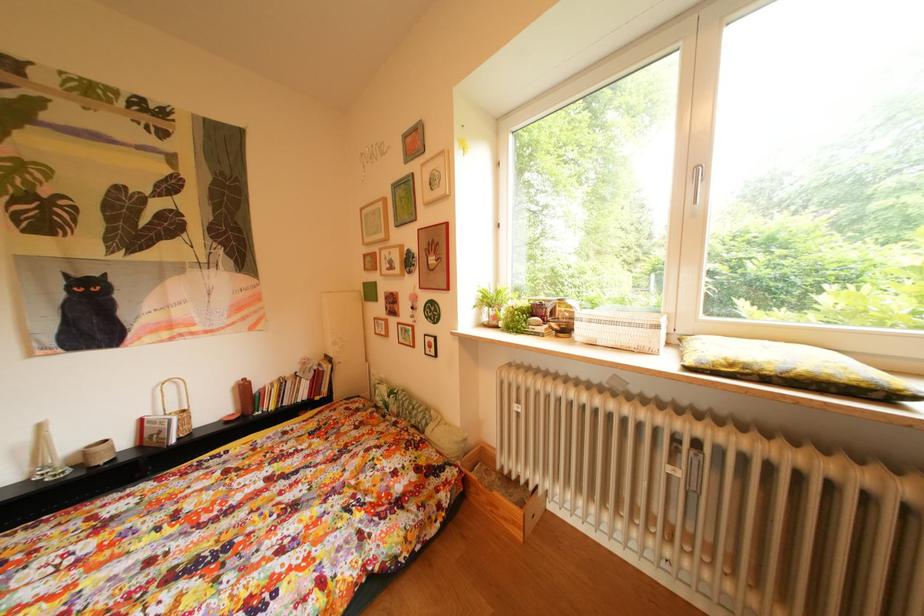
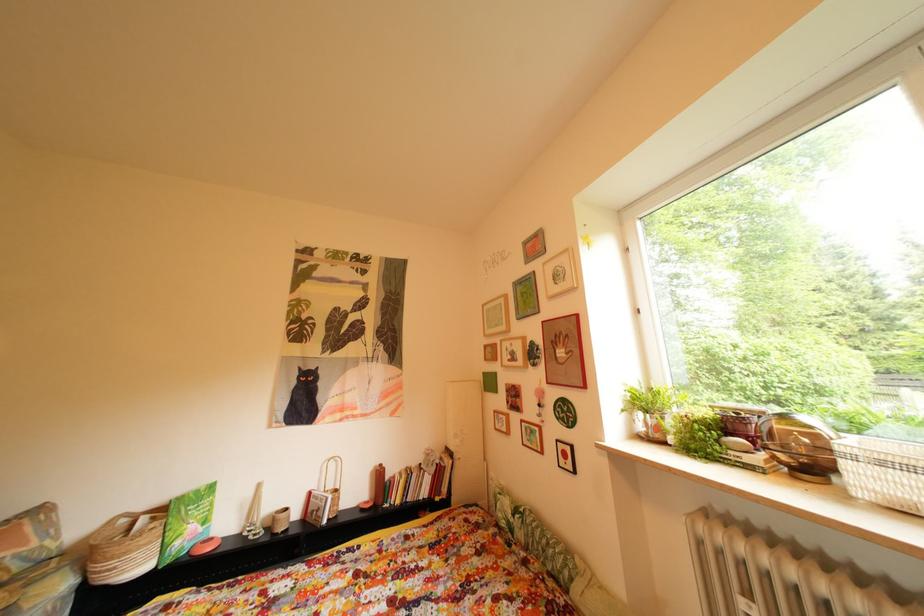
How did the camera likely rotate?

The rotation direction of the camera is left-up.